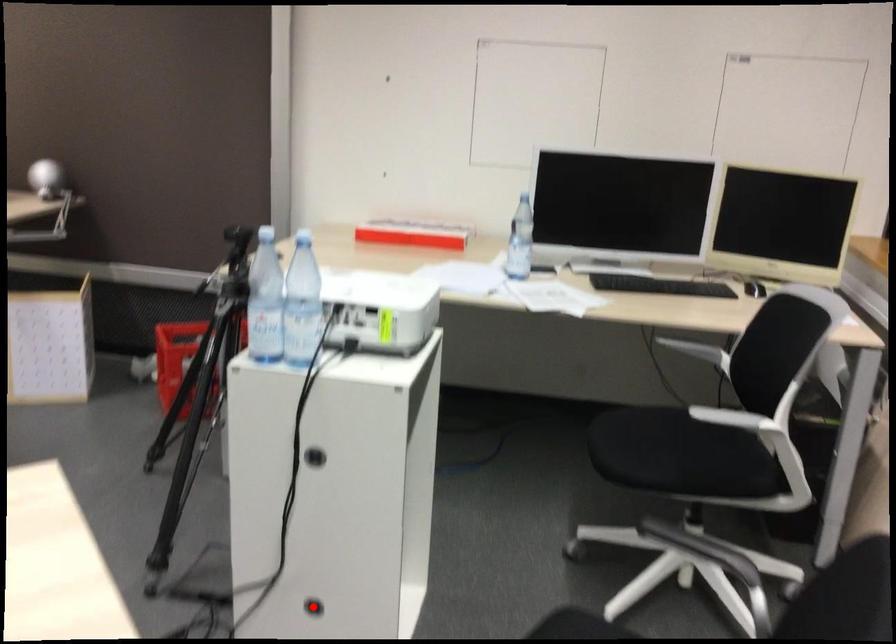
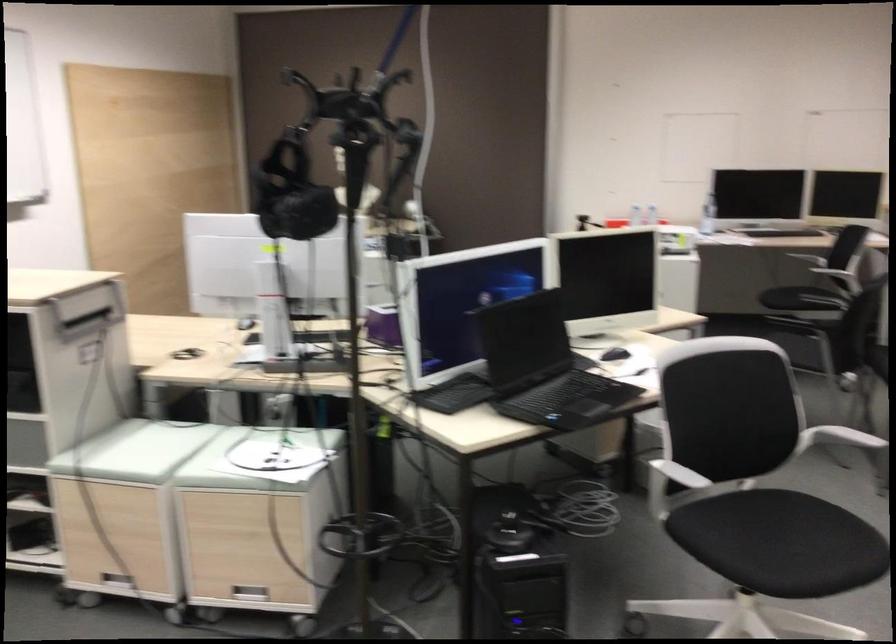
Question: I am providing you with two images of the same scene from different viewpoints. A red point is marked on the first image. Is the red point's position out of view in image 2?

Choices:
 (A) Yes
 (B) No

Answer: (A)